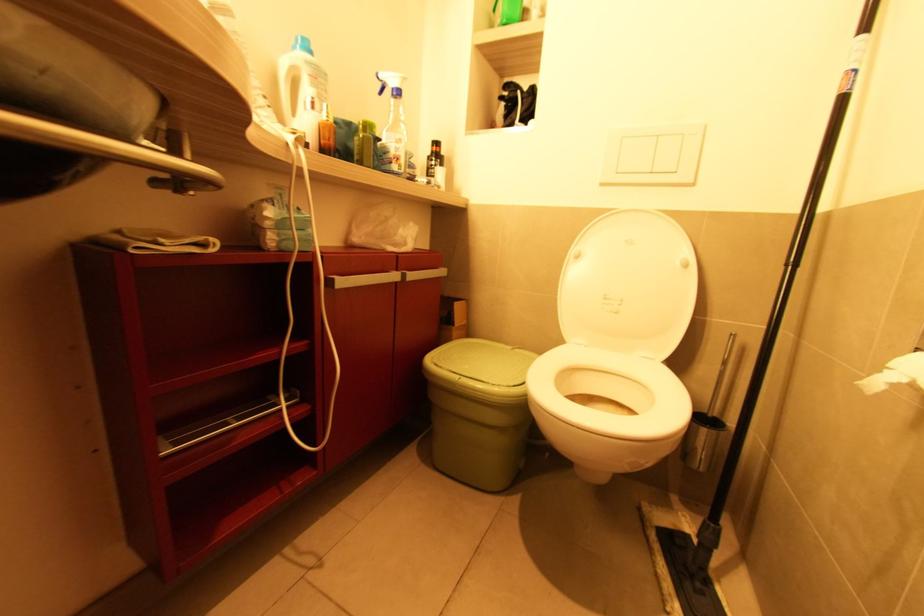
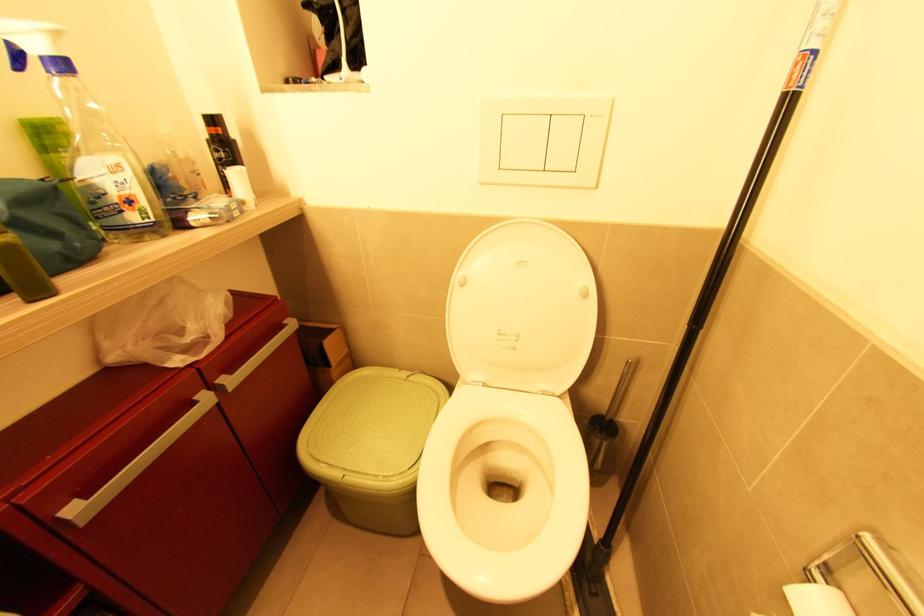
The images are taken continuously from a first-person perspective. In which direction are you moving?

The cameraman walked toward right, forward.